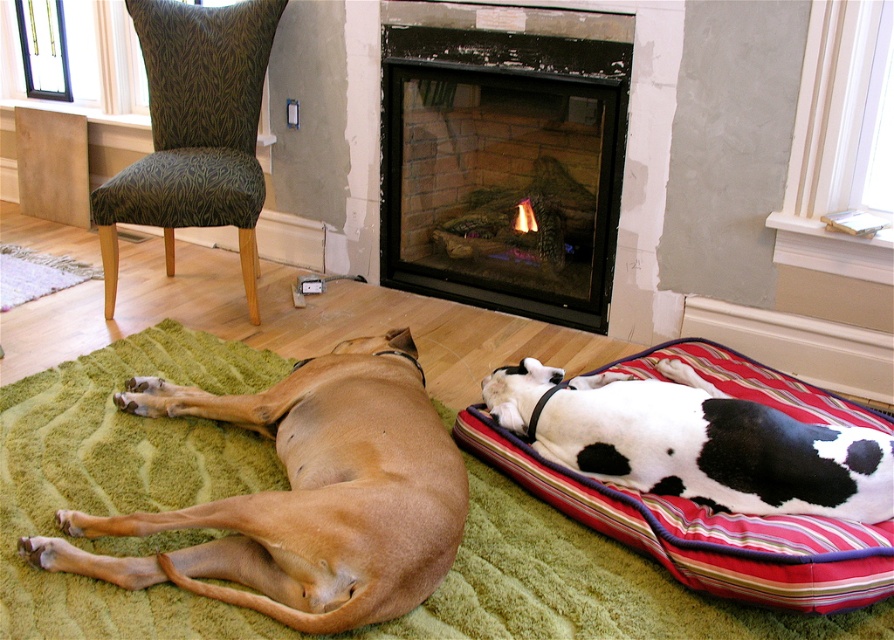
Question: Which point is farther from the camera taking this photo?

Choices:
 (A) (252, 573)
 (B) (190, 61)
 (C) (73, 412)

Answer: (B)

Question: Among these points, which one is farthest from the camera?

Choices:
 (A) pyautogui.click(x=111, y=202)
 (B) pyautogui.click(x=623, y=547)
 (C) pyautogui.click(x=614, y=163)

Answer: (A)

Question: Can you confirm if green textured rug at lower left is positioned above brown smooth dog at lower left?

Choices:
 (A) no
 (B) yes

Answer: (A)

Question: Is brick fireplace at center below black and white spotted dog at lower right?

Choices:
 (A) no
 (B) yes

Answer: (A)

Question: In this image, where is brown smooth dog at lower left located relative to brick fireplace at center?

Choices:
 (A) below
 (B) above

Answer: (A)

Question: Which point is closer to the camera?

Choices:
 (A) (582, 428)
 (B) (583, 253)
 (C) (110, 310)

Answer: (A)